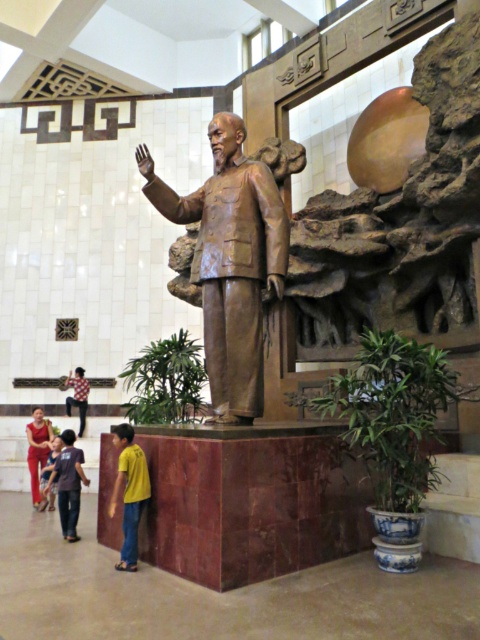
You are an interior designer assessing the statue area. You notice the yellow cotton shirt at lower left and the matte blue shirt at lower left. Which shirt is taller?

The yellow cotton shirt at lower left is much taller than the matte blue shirt at lower left.

You are standing in the room and see two points labeled as point (x=36, y=486) and point (x=48, y=474). Which point is closer to you?

Point (x=48, y=474) is closer to you because point (x=36, y=486) is behind it.

You are an artist looking to paint the statue in the scene. You notice the matte red pants at lower left and the matte blue shirt at lower left. Which part of the statue is more to the left?

The matte red pants at lower left is positioned on the left side of matte blue shirt at lower left, so the matte red pants at lower left is more to the left.